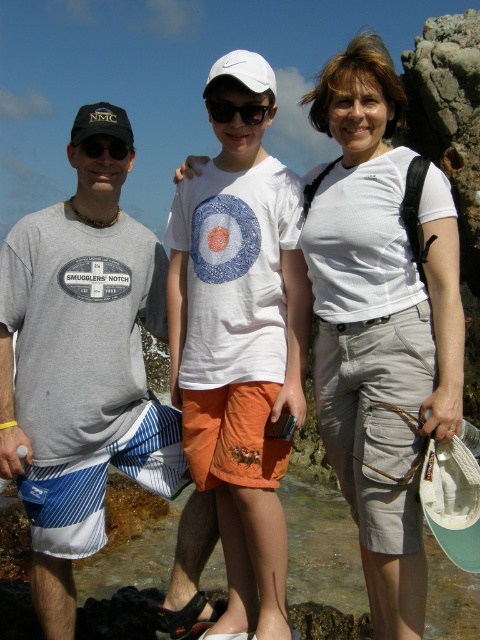
Who is more distant from viewer, (38, 250) or (80, 131)?

The point (38, 250) is behind.

Who is more forward, (95, 209) or (106, 113)?

Positioned in front is point (106, 113).

Where is `gray cotton t-shirt at left`? This screenshot has width=480, height=640. gray cotton t-shirt at left is located at coordinates (81, 372).

Does clear water at feet center appear over white matte baseball cap at center?

Actually, clear water at feet center is below white matte baseball cap at center.

Is clear water at feet center taller than white matte baseball cap at center?

No.

You are a GUI agent. You are given a task and a screenshot of the screen. Output one action in this format:
    pyautogui.click(x=<x>, y=<y>)
    Task: Click on the clear water at feet center
    The width and height of the screenshot is (480, 640).
    Given the screenshot: What is the action you would take?
    pyautogui.click(x=323, y=548)

Between point (250, 621) and point (249, 70), which one is positioned behind?

The point (249, 70) is behind.

Can you confirm if white cotton t-shirt at center is taller than white matte baseball cap at center?

Incorrect, white cotton t-shirt at center's height is not larger of white matte baseball cap at center's.

Is point (254, 440) more distant than point (240, 58)?

No, it is in front of (240, 58).

Identify the location of white cotton t-shirt at center. The height and width of the screenshot is (640, 480). (240, 349).